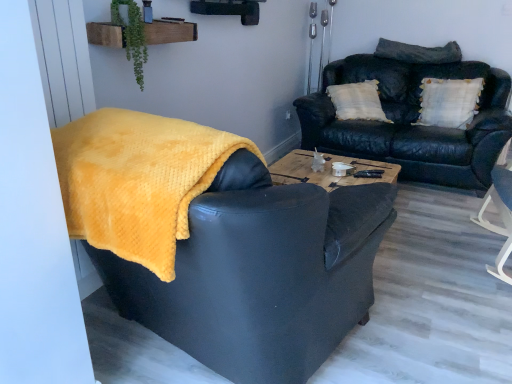
Question: Is point (452, 43) positioned closer to the camera than point (145, 54)?

Choices:
 (A) farther
 (B) closer

Answer: (A)

Question: In the image, is dark gray textured pillow at upper right, the first pillow when ordered from top to bottom, positioned in front of or behind green leafy plant at upper center?

Choices:
 (A) behind
 (B) front

Answer: (A)

Question: Which of these objects is positioned farthest from the dark gray textured pillow at upper right, placed as the 2th pillow when sorted from bottom to top?

Choices:
 (A) yellow fuzzy blanket at left
 (B) green leafy plant at upper center
 (C) leather couch at upper right
 (D) white textured pillow at upper right, the first pillow in the bottom-to-top sequence

Answer: (A)

Question: Estimate the real-world distances between objects in this image. Which object is farther from the leather couch at upper right?

Choices:
 (A) yellow fuzzy blanket at left
 (B) green leafy plant at upper center
 (C) white textured pillow at upper right, the first pillow in the bottom-to-top sequence
 (D) dark gray textured pillow at upper right, the first pillow when ordered from top to bottom

Answer: (B)